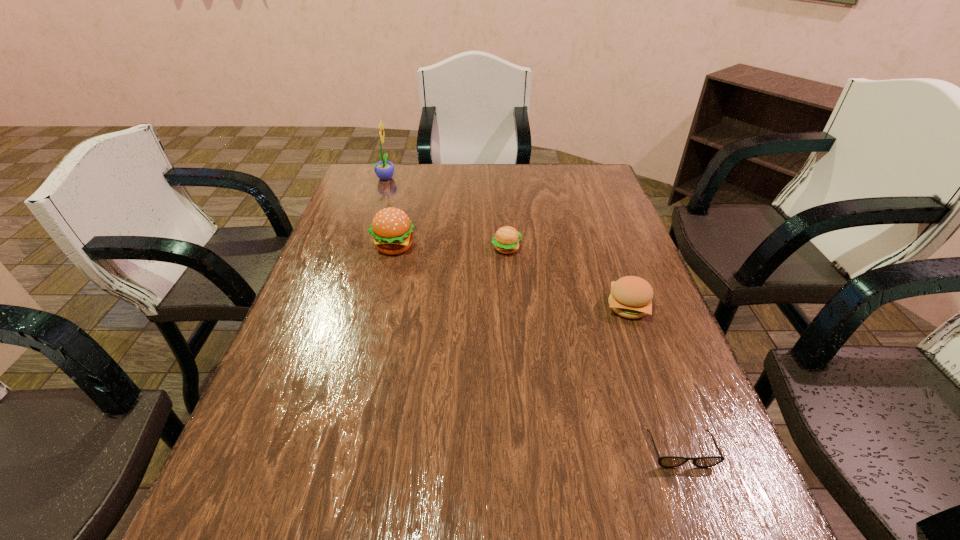
Where is `sunflower`? This screenshot has height=540, width=960. sunflower is located at coordinates (x=384, y=170).

The height and width of the screenshot is (540, 960). I want to click on the tallest object, so click(384, 170).

Locate an element on the screen. This screenshot has width=960, height=540. the leftmost hamburger is located at coordinates (391, 228).

Locate an element on the screen. The height and width of the screenshot is (540, 960). the tallest hamburger is located at coordinates (391, 228).

This screenshot has height=540, width=960. I want to click on the nearest hamburger, so click(x=631, y=297).

Where is `the second nearest object`? Image resolution: width=960 pixels, height=540 pixels. the second nearest object is located at coordinates (631, 297).

I want to click on the second hamburger from right to left, so click(x=506, y=240).

Where is `the fourth tallest object`? the fourth tallest object is located at coordinates (506, 240).

Identify the location of the shortest object. (666, 461).

The height and width of the screenshot is (540, 960). In order to click on the nearest object in this screenshot , I will do `click(666, 461)`.